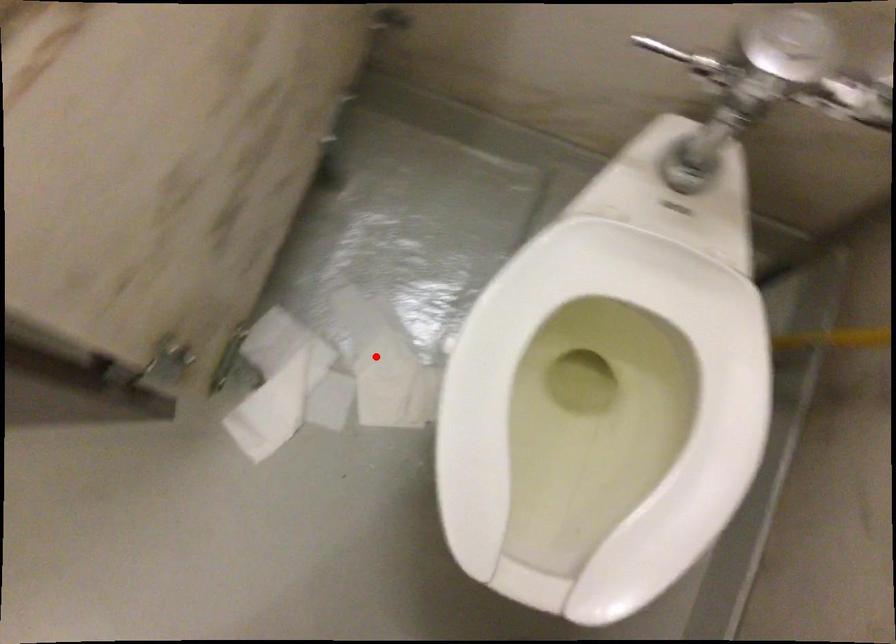
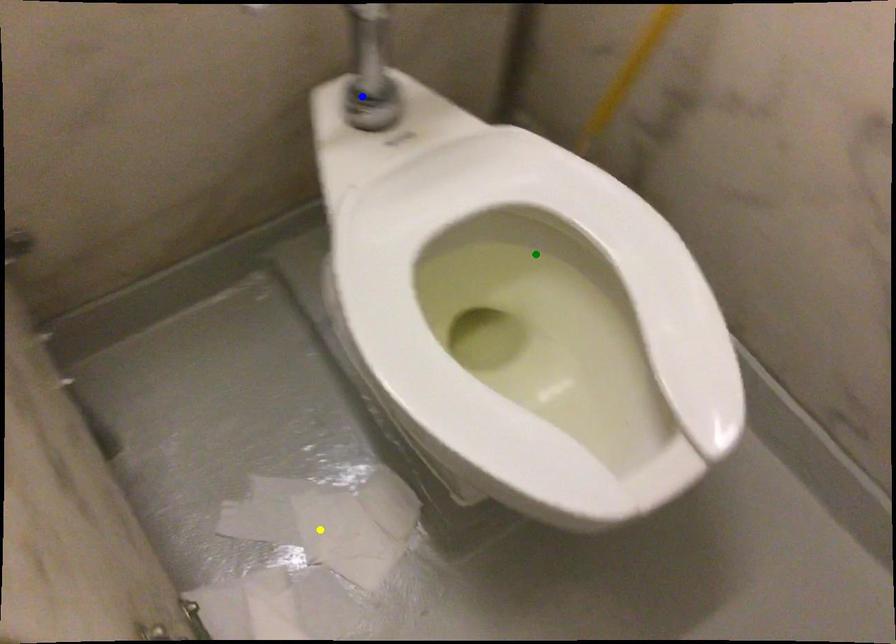
Question: I am providing you with two images of the same scene from different viewpoints. A red point is marked on the first image. You are given multiple points on the second image. Which spot in image 2 lines up with the point in image 1?

Choices:
 (A) green point
 (B) blue point
 (C) yellow point

Answer: (C)